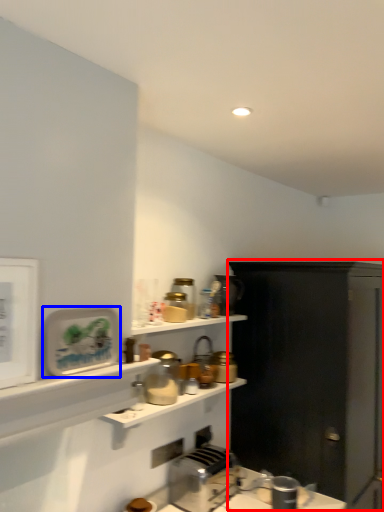
Question: Among these objects, which one is nearest to the camera, cabinetry (highlighted by a red box) or appliance (highlighted by a blue box)?

Choices:
 (A) cabinetry
 (B) appliance

Answer: (B)